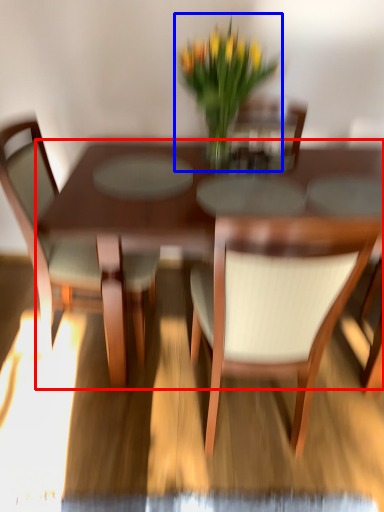
Question: Which object appears closest to the camera in this image, kitchen & dining room table (highlighted by a red box) or houseplant (highlighted by a blue box)?

Choices:
 (A) kitchen & dining room table
 (B) houseplant

Answer: (A)